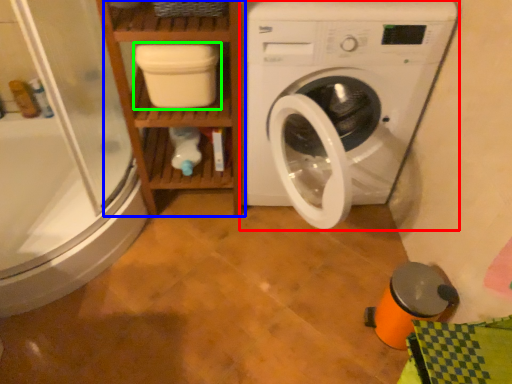
Question: Which is farther away from washing machine (highlighted by a red box)? shelf (highlighted by a blue box) or dish washer (highlighted by a green box)?

Choices:
 (A) shelf
 (B) dish washer

Answer: (B)